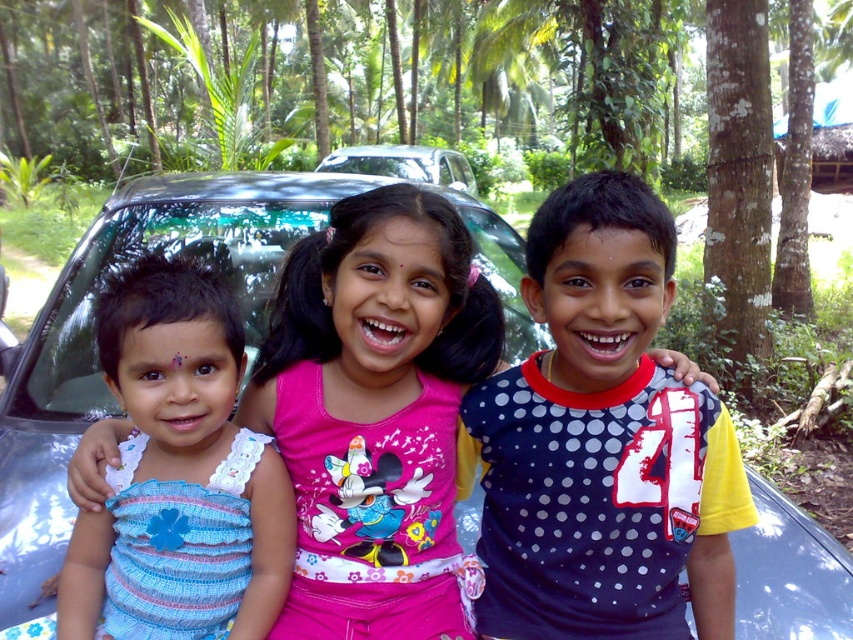
Is polka dot jersey at center thinner than metallic blue car at center?

Yes, polka dot jersey at center is thinner than metallic blue car at center.

Does polka dot jersey at center come behind metallic blue car at center?

No, polka dot jersey at center is in front of metallic blue car at center.

Identify the location of polka dot jersey at center. (602, 442).

This screenshot has width=853, height=640. I want to click on polka dot jersey at center, so click(x=602, y=442).

Does blue striped dress at left have a smaller size compared to satin black car at center?

Yes.

Which is more to the right, blue striped dress at left or satin black car at center?

Positioned to the right is blue striped dress at left.

Where is `blue striped dress at left`? blue striped dress at left is located at coordinates point(173,365).

Is metallic blue car at center closer to the viewer compared to blue striped dress at left?

No.

Between metallic blue car at center and blue striped dress at left, which one is positioned lower?

blue striped dress at left is lower down.

Who is more forward, (750, 561) or (231, 634)?

Point (231, 634)

What are the coordinates of `metallic blue car at center` in the screenshot? It's located at (94, 348).